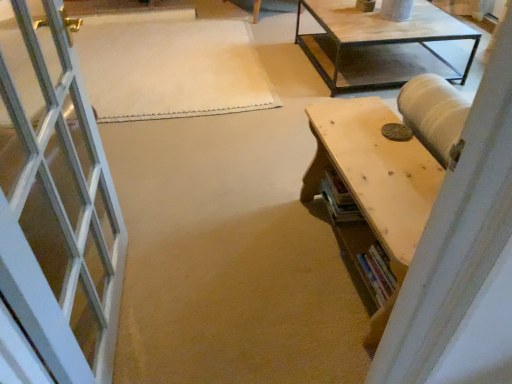
The height and width of the screenshot is (384, 512). What are the coordinates of `empty space that is ontop of wooden table at right (from a real-world perspective)` in the screenshot? It's located at (380, 157).